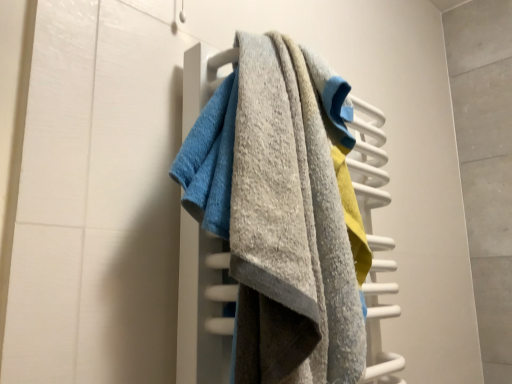
Where is `textured gray towel at center`? This screenshot has height=384, width=512. textured gray towel at center is located at coordinates (291, 227).

What do you see at coordinates (291, 227) in the screenshot?
I see `textured gray towel at center` at bounding box center [291, 227].

Identify the location of textured gray towel at center. This screenshot has height=384, width=512. (291, 227).